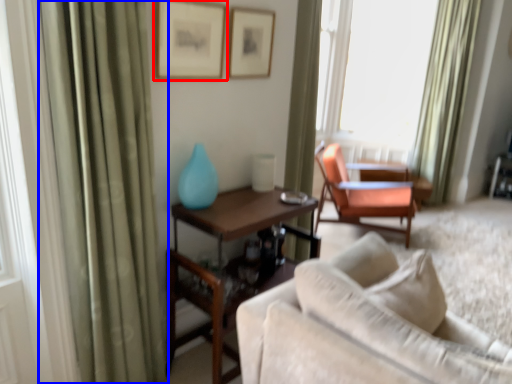
Question: Which object is closer to the camera taking this photo, picture frame (highlighted by a red box) or curtain (highlighted by a blue box)?

Choices:
 (A) picture frame
 (B) curtain

Answer: (B)